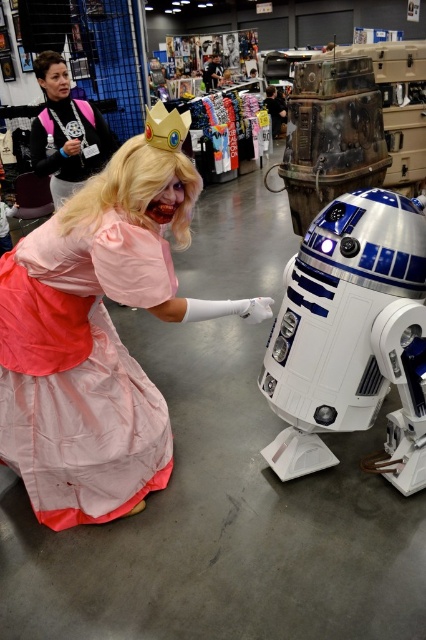
You are a photographer at the event and want to capture a photo of the Princess Peach costume. The pink satin dress at center and the matte black jacket at upper left are both in the frame. Which object should you focus on first if you want to ensure both are in focus?

The pink satin dress at center is positioned under the matte black jacket at upper left, so focusing on the matte black jacket at upper left first would ensure both are in focus since it is closer to the camera.

You are taking a photo of the Princess Peach costume at the convention. You notice two points on the costume marked as point 1 at coordinates point (63,280) and point 2 at coordinates point (193,180). Which point is closer to the camera?

Point (63,280) is further to the camera than point (193,180), so point (193,180) is closer to the camera.